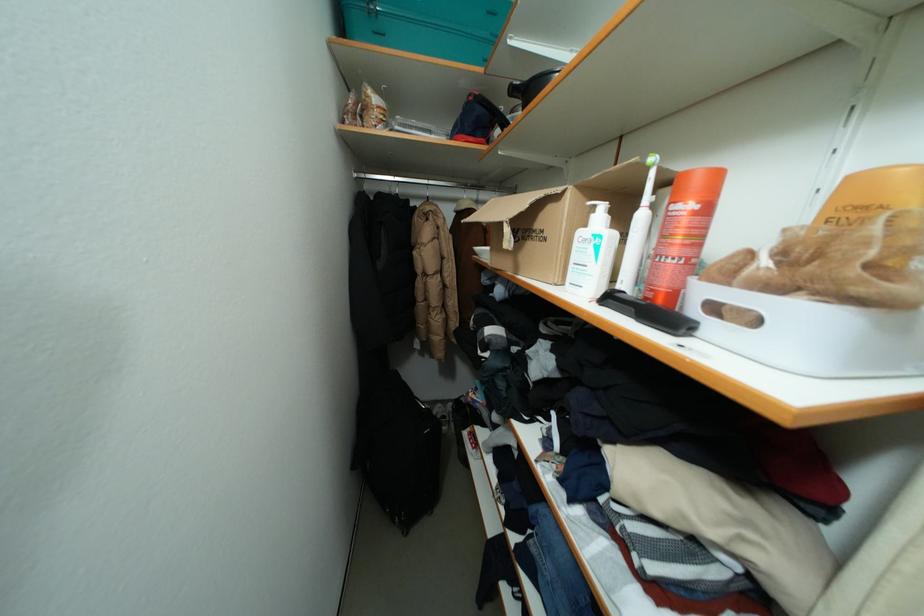
This screenshot has width=924, height=616. In order to click on cardboard box in this screenshot , I will do `click(532, 238)`.